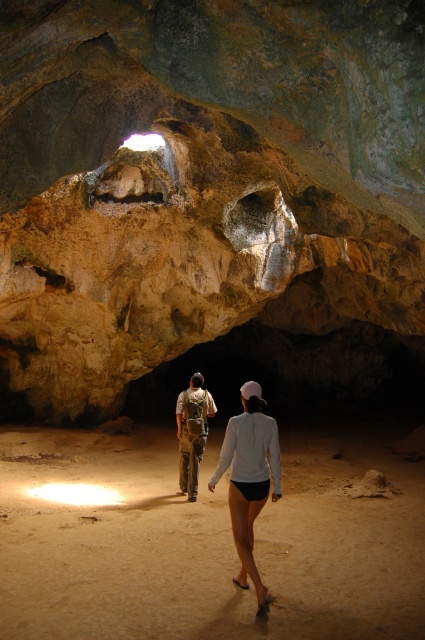
Between rustic stone cave at center and camouflage fabric backpack at center, which one has less height?

camouflage fabric backpack at center

Which is in front, point (418, 182) or point (180, 465)?

Point (418, 182) is more forward.

You are a GUI agent. You are given a task and a screenshot of the screen. Output one action in this format:
    pyautogui.click(x=<x>, y=<y>)
    Task: Click on the rustic stone cave at center
    This screenshot has width=425, height=640.
    Given the screenshot: What is the action you would take?
    pyautogui.click(x=206, y=193)

Between point (193, 88) and point (240, 552), which one is positioned behind?

The point (240, 552) is behind.

Can you confirm if rustic stone cave at center is positioned to the right of white matte shorts at center?

No, rustic stone cave at center is not to the right of white matte shorts at center.

Is point (243, 285) in front of point (261, 493)?

That is False.

At what (x,y) coordinates should I click in order to perform the action: click on rustic stone cave at center. Please return your answer as a coordinate pair (x, y). This screenshot has width=425, height=640. Looking at the image, I should click on (206, 193).

Is white matte shorts at center smaller than camouflage fabric backpack at center?

Actually, white matte shorts at center might be larger than camouflage fabric backpack at center.

The width and height of the screenshot is (425, 640). Identify the location of white matte shorts at center. (249, 480).